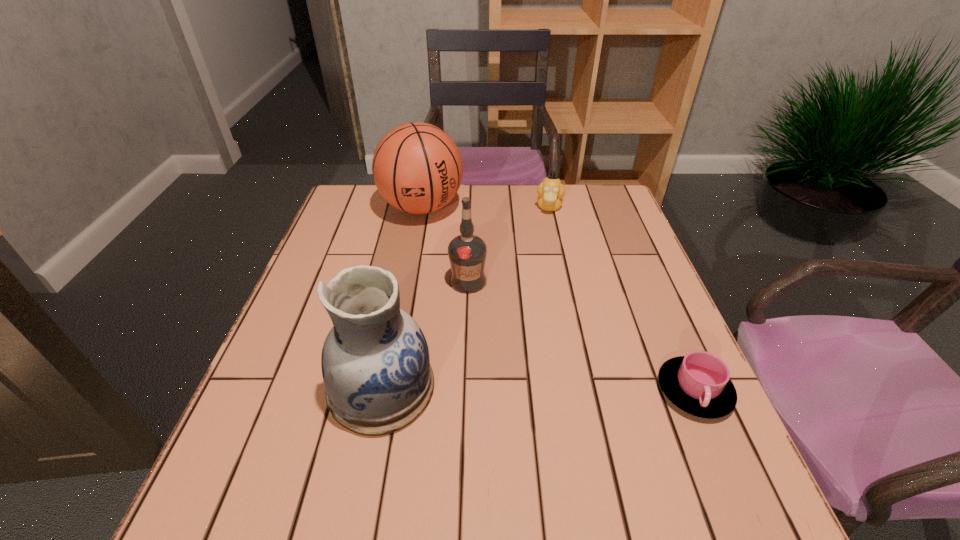
I want to click on vacant area that lies between the rightmost object and the duckling, so click(x=621, y=299).

You are a GUI agent. You are given a task and a screenshot of the screen. Output one action in this format:
    pyautogui.click(x=<x>, y=<y>)
    Task: Click on the empty space that is in between the vodka and the second shortest object
    This screenshot has width=960, height=540.
    Given the screenshot: What is the action you would take?
    pyautogui.click(x=509, y=244)

The image size is (960, 540). I want to click on vacant area between the pottery and the cup, so click(538, 389).

Find the location of a particular element. This screenshot has width=960, height=540. unoccupied position between the third farthest object and the cup is located at coordinates (581, 336).

At what (x,y) coordinates should I click in order to perform the action: click on free space between the pottery and the second object from right to left. Please return your answer as a coordinate pair (x, y). Looking at the image, I should click on (465, 298).

Identify the location of empty space that is in between the pottery and the third nearest object. (424, 334).

Where is `object that is the nearest to the pottery`? object that is the nearest to the pottery is located at coordinates (467, 252).

Where is `object that is the third closest to the basketball`? The height and width of the screenshot is (540, 960). object that is the third closest to the basketball is located at coordinates (375, 362).

Find the location of a particular element. free spot that satisfies the following two spatial constraints: 1. on the front side of the vodka; 2. on the left side of the basketball is located at coordinates (408, 281).

Locate an element on the screen. vacant space that satisfies the following two spatial constraints: 1. on the front side of the basketball; 2. on the right side of the vodka is located at coordinates (408, 281).